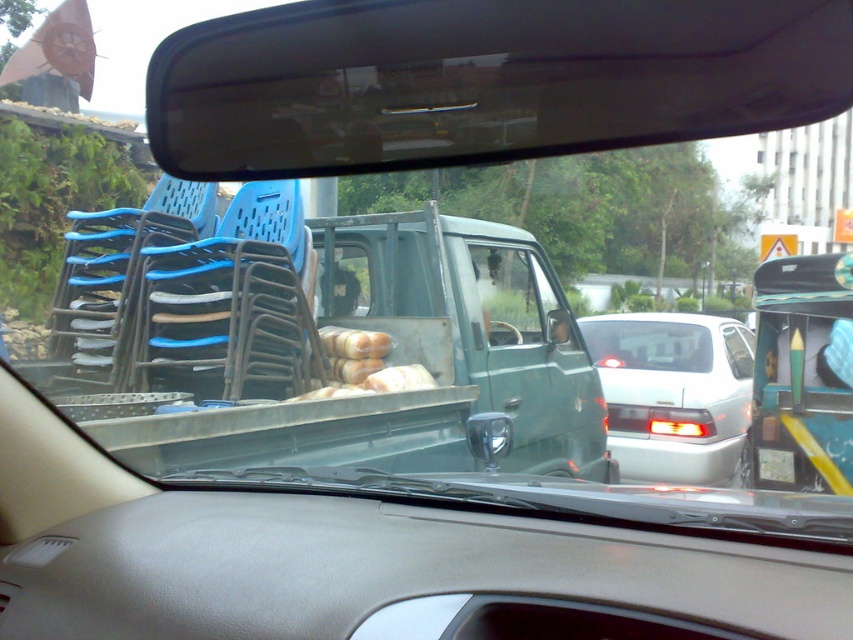
Is point (241, 109) positioned behind point (817, 304)?

No.

Is transparent plastic windshield at upper center to the right of green matte truck at center from the viewer's perspective?

In fact, transparent plastic windshield at upper center is to the left of green matte truck at center.

Is point (543, 35) positioned after point (824, 344)?

No, (543, 35) is in front of (824, 344).

Find the location of a particular element. transparent plastic windshield at upper center is located at coordinates (483, 81).

Does transparent plastic windshield at upper center appear under silver metallic sedan at center?

No, transparent plastic windshield at upper center is not below silver metallic sedan at center.

Does point (329, 150) come farther from viewer compared to point (640, 356)?

No, (329, 150) is closer to viewer.

Consider the image. Measure the distance between point (x=766, y=56) and camera.

6.11 feet

Locate an element on the screen. transparent plastic windshield at upper center is located at coordinates (483, 81).

Can you confirm if gray leather dashboard at center is positioned above white plastic license plate at center?

Indeed, gray leather dashboard at center is positioned over white plastic license plate at center.

Is gray leather dashboard at center to the left of white plastic license plate at center from the viewer's perspective?

Yes, gray leather dashboard at center is to the left of white plastic license plate at center.

Does point (297, 522) come behind point (764, 481)?

No.

The width and height of the screenshot is (853, 640). What are the coordinates of `gray leather dashboard at center` in the screenshot? It's located at (395, 573).